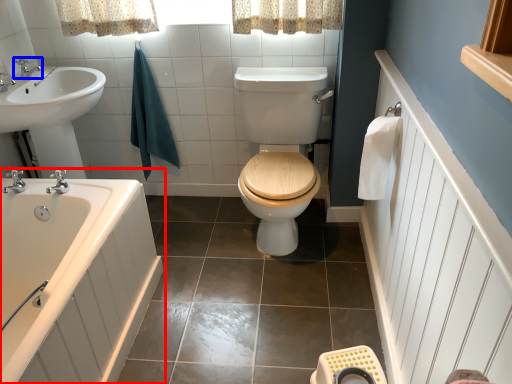
Question: Which point is further to the camera, bathtub (highlighted by a red box) or tap (highlighted by a blue box)?

Choices:
 (A) bathtub
 (B) tap

Answer: (B)